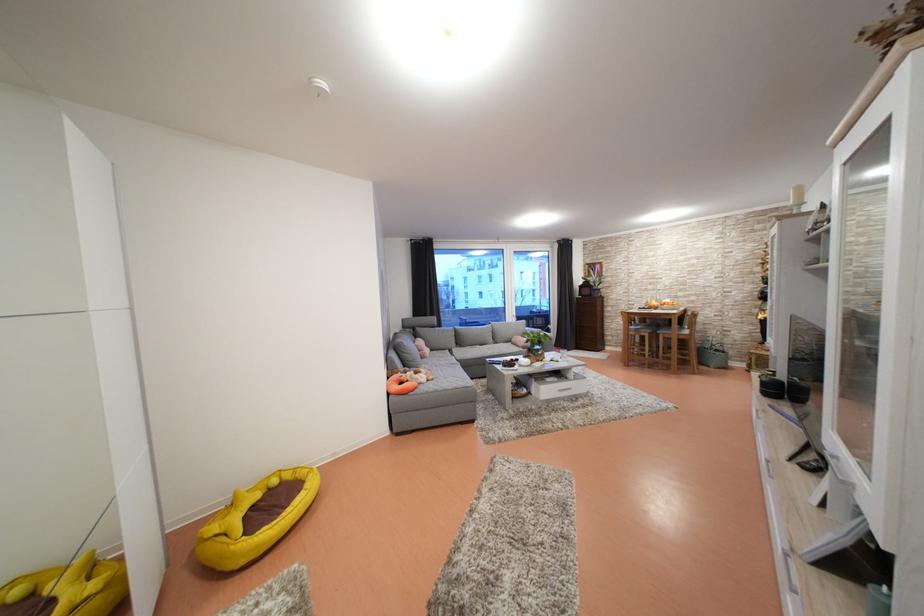
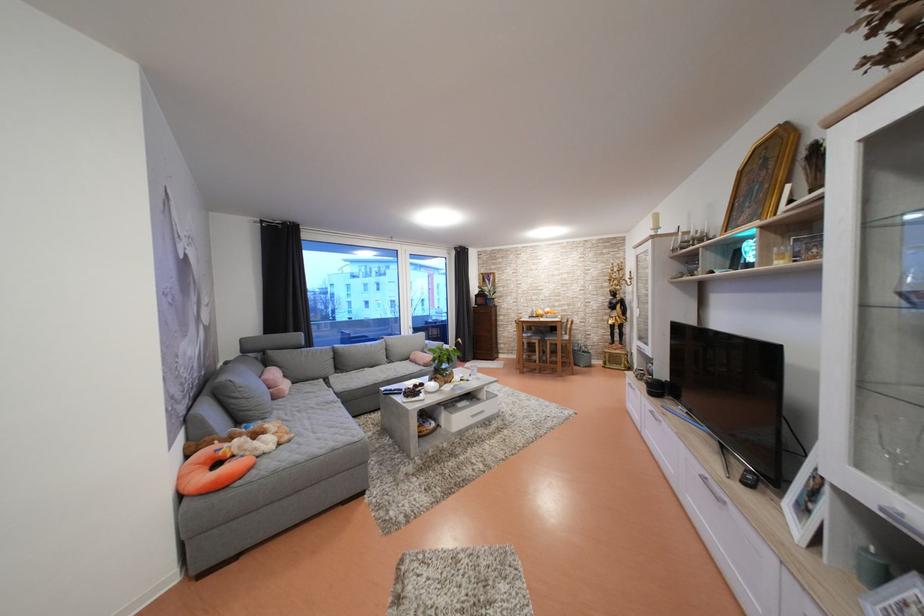
The point at (775, 467) is marked in the first image. Where is the corresponding point in the second image?

(711, 484)